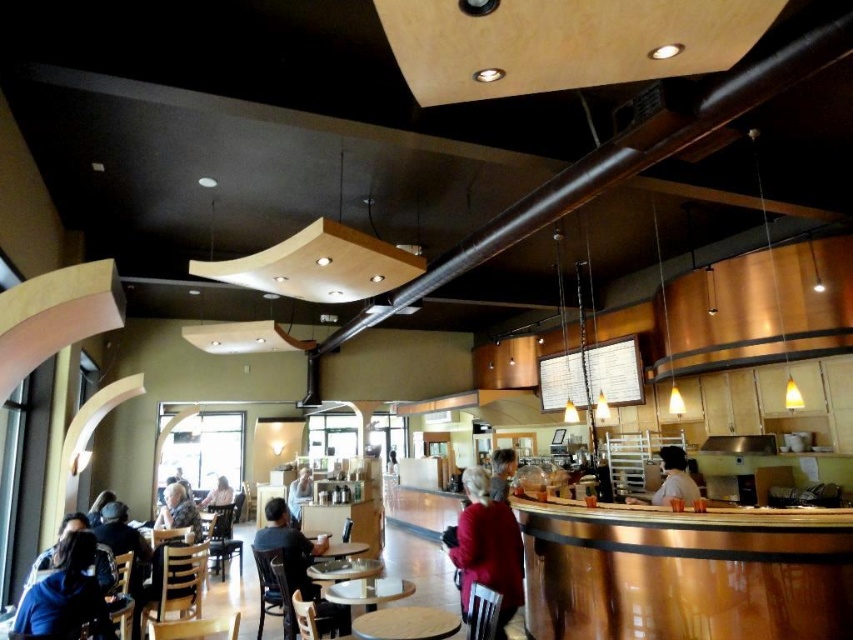
You are a customer entering the modern cafe and want to sit at the wooden round table at center. However, you are wearing a dark blue jacket at lower left. Will the table be wide enough to accommodate your jacket when you place it on the table?

The wooden round table at center has a lesser width compared to dark blue jacket at lower left, so the table is not wide enough to accommodate the jacket when placed on it.

You are a customer sitting at a table in the modern cafe and want to reach the menu board mounted on the wall. You notice two points marked as point 1 at coordinates (x=337, y=588) and point 2 at coordinates (x=64, y=532). Which point should you walk towards to get closer to the menu board?

You should walk towards point 1 at coordinates (x=337, y=588) because it is in front of point 2 at coordinates (x=64, y=532), meaning it is closer to the menu board.

Consider the image. You are standing at the entrance of the modern cafe and want to sit at the wooden round table at center. According to the coordinates provided, in which direction should you walk to reach it?

The wooden round table at center is located at coordinates point (368,589), so you should walk towards the center of the cafe to reach it.